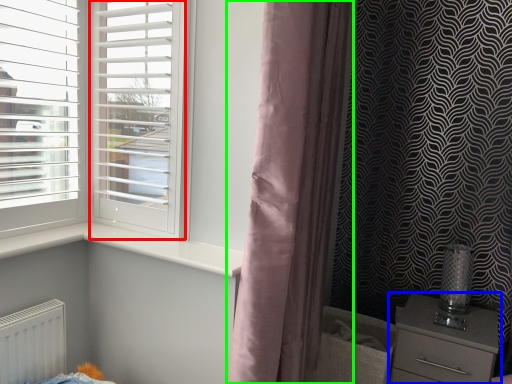
Question: Which object is positioned farthest from screen door (highlighted by a red box)? Select from chest of drawers (highlighted by a blue box) and curtain (highlighted by a green box).

Choices:
 (A) chest of drawers
 (B) curtain

Answer: (A)